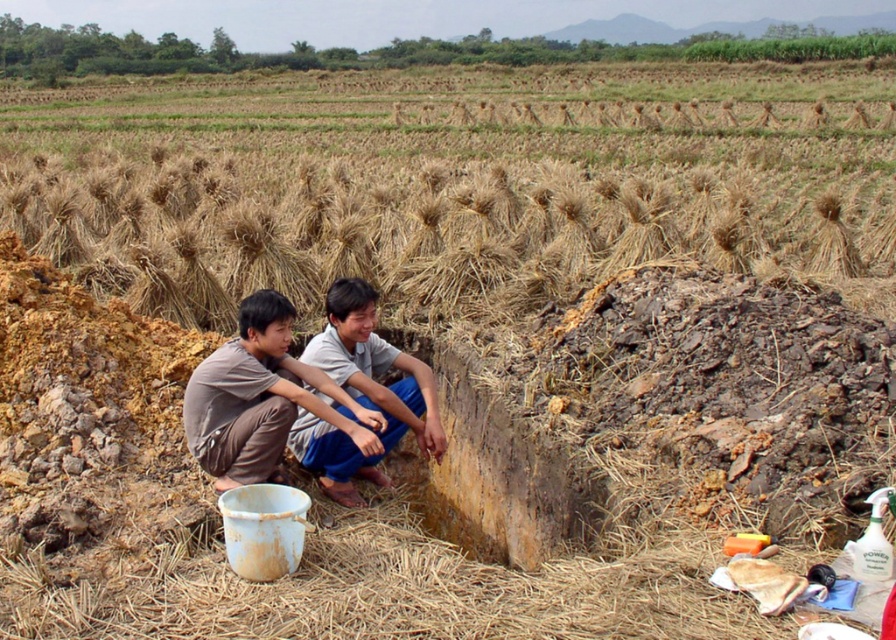
Question: Is brown straw at center below brown cotton shirt at center?

Choices:
 (A) yes
 (B) no

Answer: (B)

Question: In this image, where is brown straw at center located relative to brown cotton shirt at center?

Choices:
 (A) left
 (B) right

Answer: (A)

Question: Which of the following is the closest to the observer?

Choices:
 (A) brown cotton shirt at center
 (B) brown fabric squat at center

Answer: (A)

Question: Among these objects, which one is nearest to the camera?

Choices:
 (A) brown fabric squat at center
 (B) brown cotton shirt at center
 (C) brown straw at center

Answer: (B)

Question: Which point is closer to the camera?

Choices:
 (A) brown straw at center
 (B) brown fabric squat at center

Answer: (B)

Question: Is brown cotton shirt at center bigger than brown fabric squat at center?

Choices:
 (A) no
 (B) yes

Answer: (A)